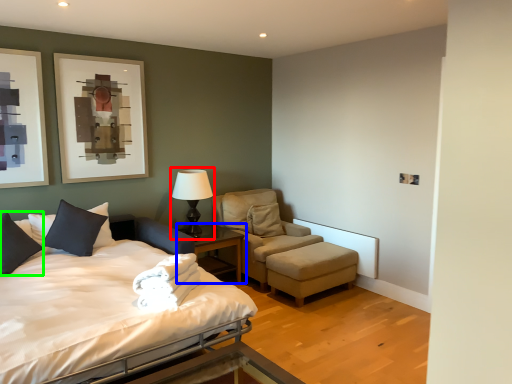
Question: Which object is the closest to the table lamp (highlighted by a red box)? Choose among these: nightstand (highlighted by a blue box) or pillow (highlighted by a green box).

Choices:
 (A) nightstand
 (B) pillow

Answer: (A)